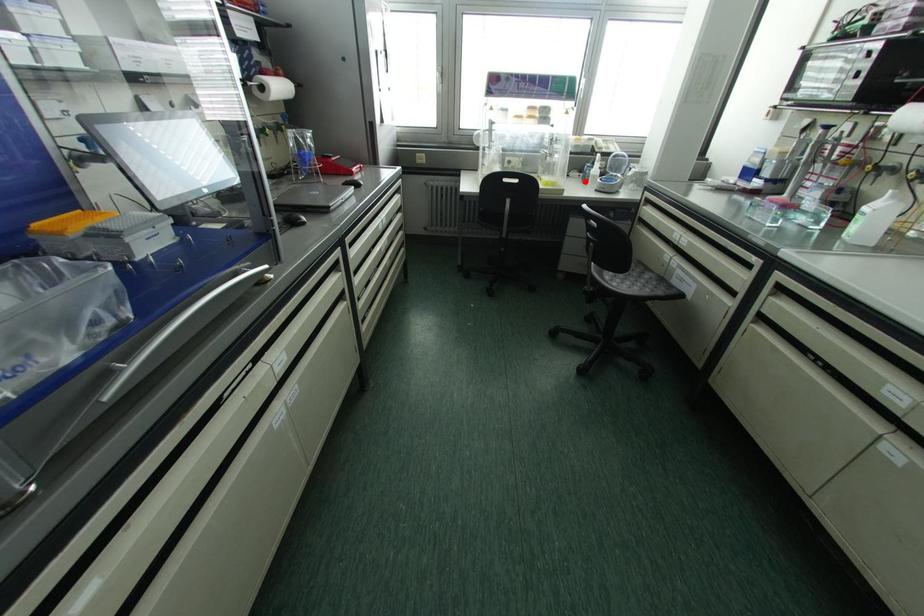
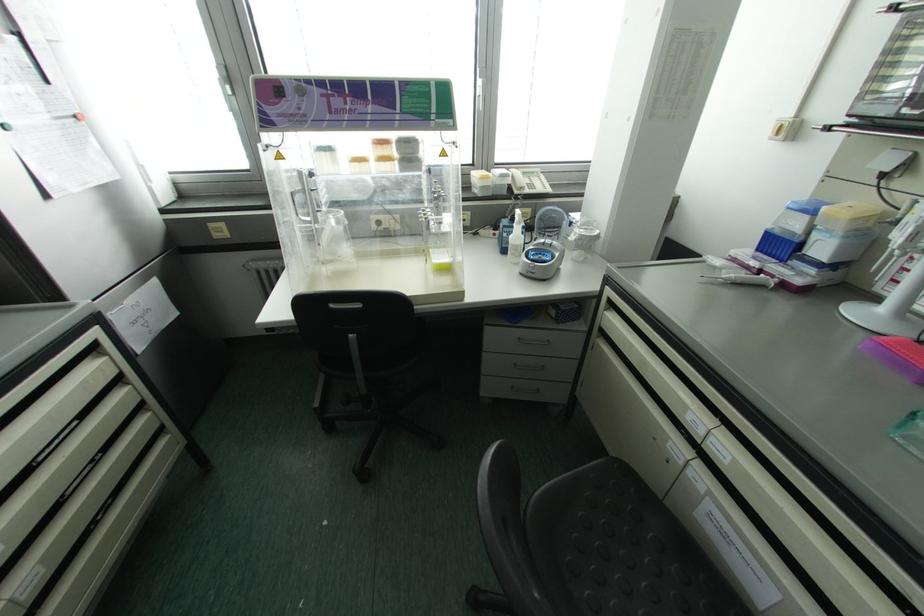
Where in the second image is the point corresponding to the highlighted location from the first image?

(504, 251)